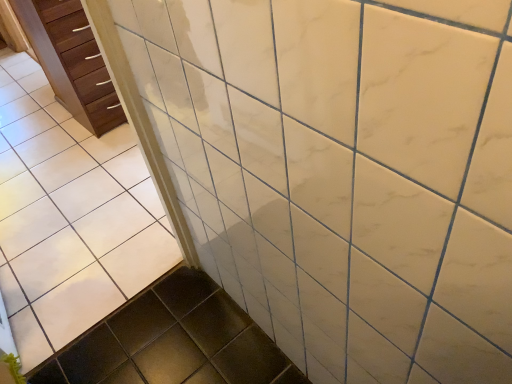
Question: From the image's perspective, relative to white glossy tile at upper center, is wooden chest of drawers at left above or below?

Choices:
 (A) above
 (B) below

Answer: (A)

Question: In the image, is wooden chest of drawers at left on the left side or the right side of white glossy tile at upper center?

Choices:
 (A) left
 (B) right

Answer: (A)

Question: Is point (113, 87) closer or farther from the camera than point (16, 228)?

Choices:
 (A) farther
 (B) closer

Answer: (A)

Question: From the image's perspective, is white glossy tile at upper center located above or below wooden chest of drawers at left?

Choices:
 (A) below
 (B) above

Answer: (A)

Question: From a real-world perspective, relative to wooden chest of drawers at left, is white glossy tile at upper center vertically above or below?

Choices:
 (A) below
 (B) above

Answer: (B)

Question: Would you say white glossy tile at upper center is to the left or to the right of wooden chest of drawers at left in the picture?

Choices:
 (A) left
 (B) right

Answer: (B)

Question: Considering the positions of point pos(46,321) and point pos(46,49), is point pos(46,321) closer or farther from the camera than point pos(46,49)?

Choices:
 (A) closer
 (B) farther

Answer: (A)